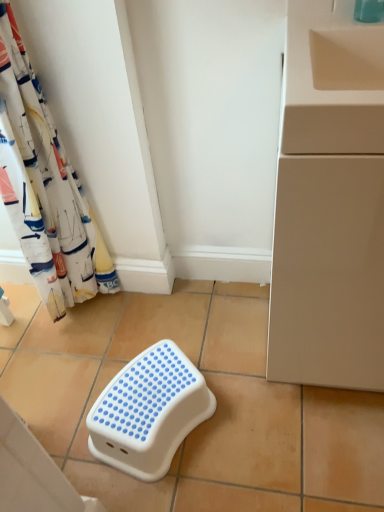
Locate an element on the screen. free space between white fabric curtain at left and beige ceramic tile at lower left, placed as the 1th ceramic tile when sorted from left to right is located at coordinates (63, 368).